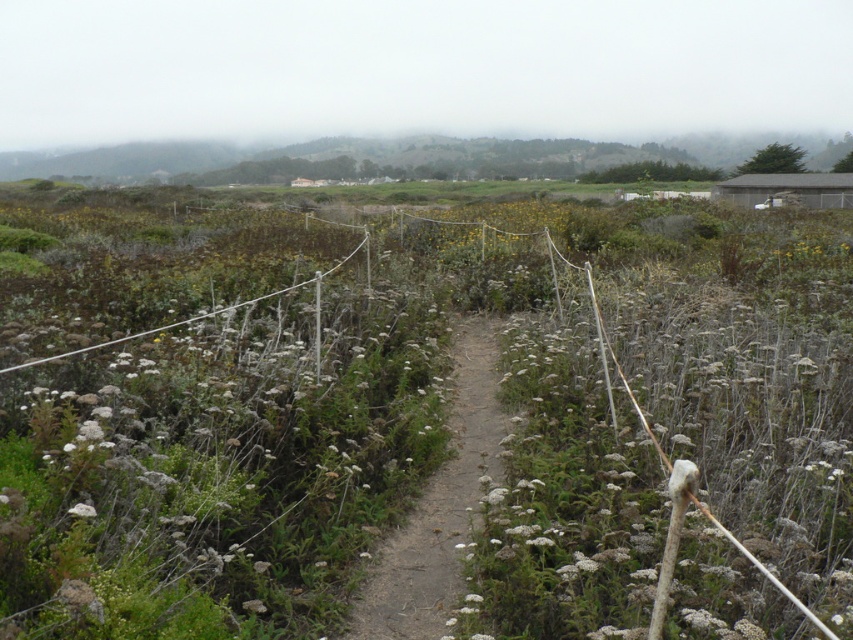
You are a hiker trying to follow the dirt path at center through the field. There is a green matte plant at center blocking your way. Can you walk around it without leaving the path?

The green matte plant at center is larger than the dirt path at center, so it might block the entire path. You may need to detour around it carefully or find another route.

Looking at this image, you are a hiker standing at the edge of the field. You see the dirt path at center and the white fluffy flower at center. Which object is positioned to the right of the other?

The dirt path at center is to the right of the white fluffy flower at center.

Consider the image. You are a gardener who wants to plant a new flower that needs at least 20 cm of space. You see the dirt path at center and the white fluffy flower at center in the image. Which location would be suitable for planting the new flower?

The dirt path at center has a width larger than the white fluffy flower at center, so the dirt path at center is suitable for planting the new flower since it provides enough space.